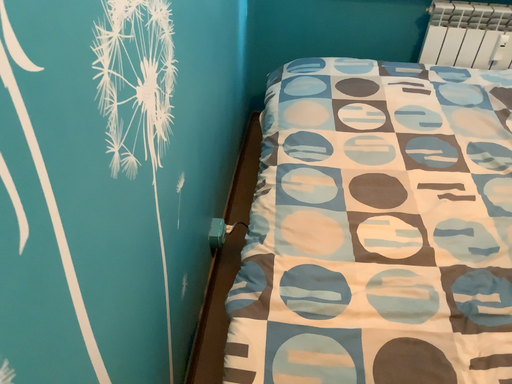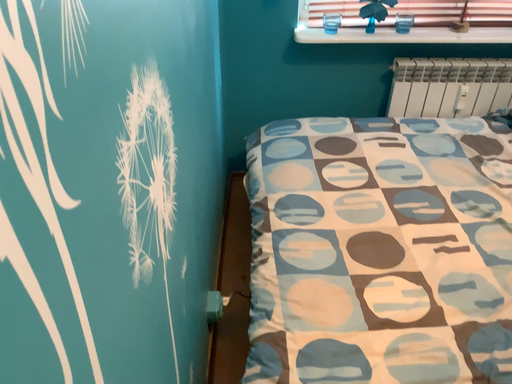
Question: Which way did the camera rotate in the video?

Choices:
 (A) rotated downward
 (B) rotated upward

Answer: (B)